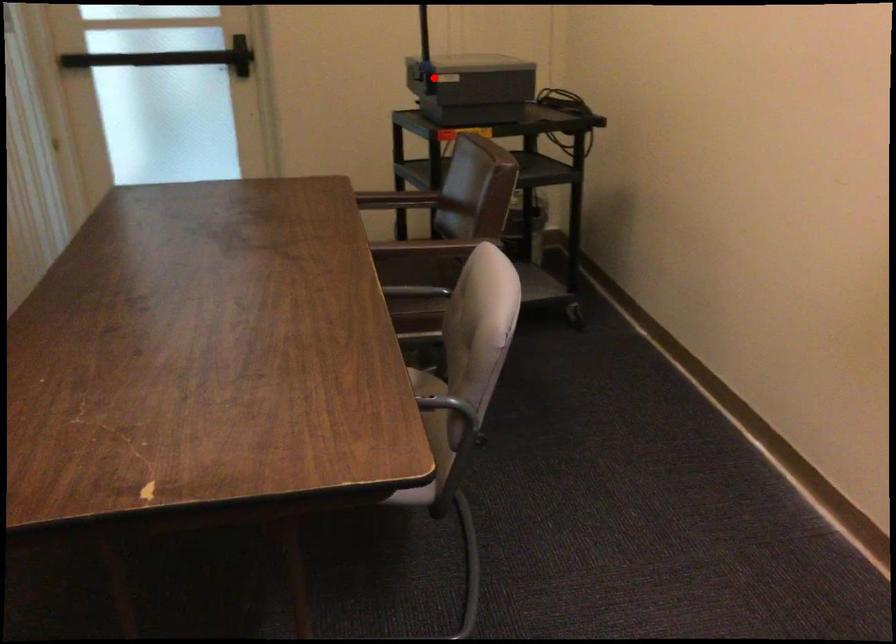
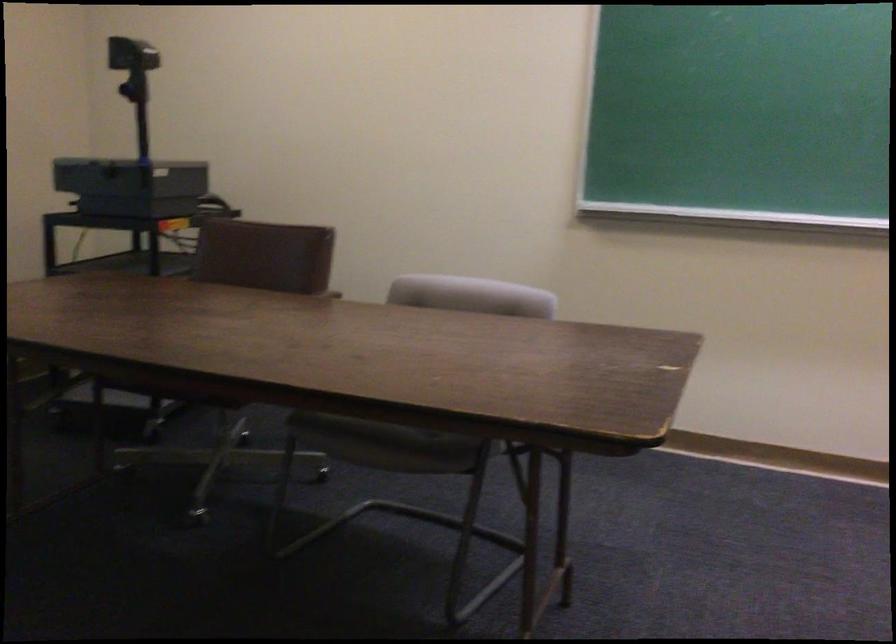
Where in the second image is the point corresponding to the highlighted location from the first image?

(131, 180)